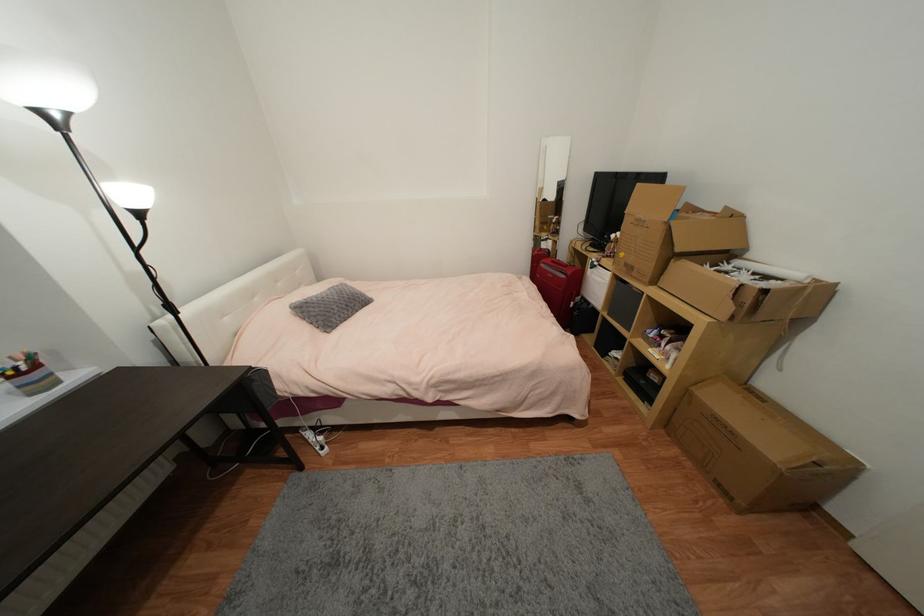
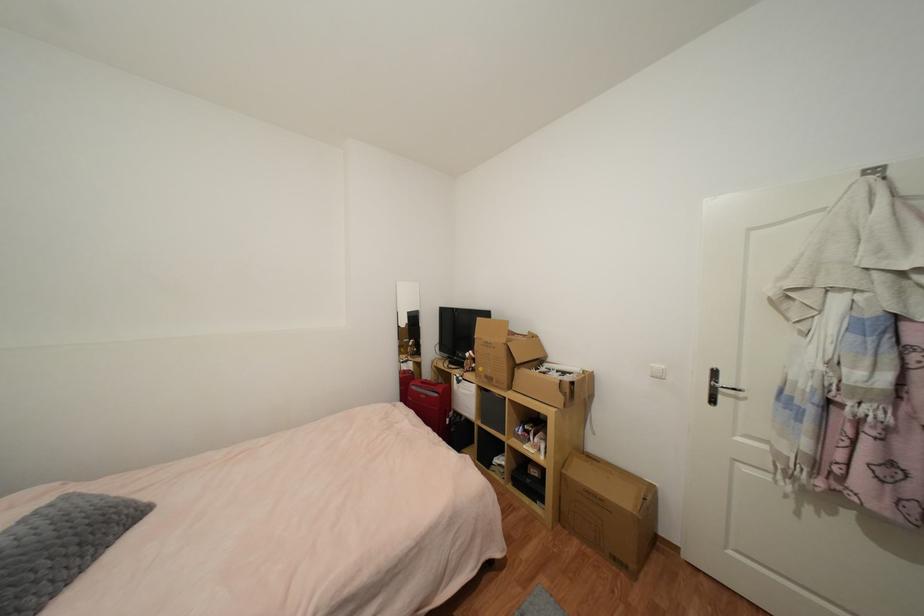
Where in the second image is the point corresponding to point 567,278 from the first image?

(440, 397)